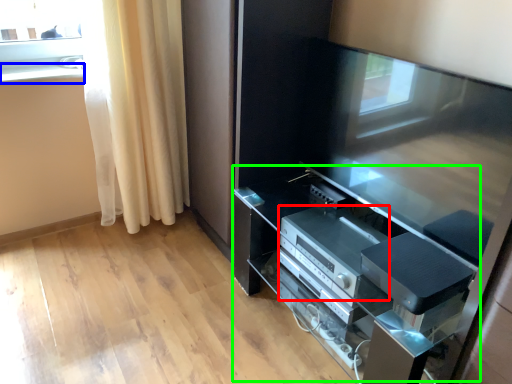
Question: Which is nearer to the appliance (highlighted by a red box)? window sill (highlighted by a blue box) or tv cabinet (highlighted by a green box).

Choices:
 (A) window sill
 (B) tv cabinet

Answer: (B)